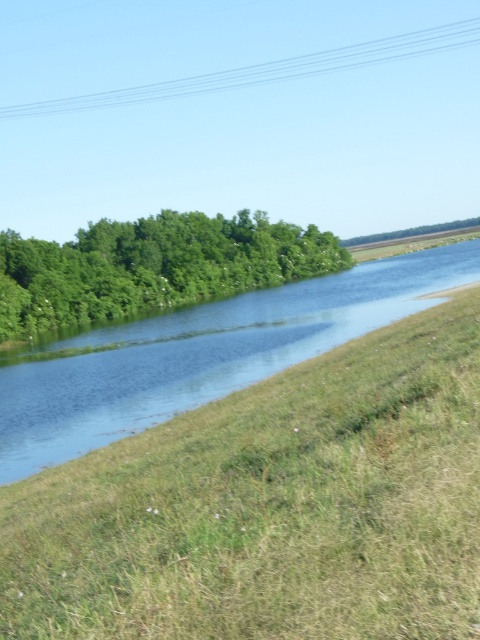
Question: Can you confirm if blue smooth water at center is smaller than green leafy trees at center?

Choices:
 (A) yes
 (B) no

Answer: (A)

Question: Is blue smooth water at center to the left of green leafy trees at center from the viewer's perspective?

Choices:
 (A) no
 (B) yes

Answer: (A)

Question: Which object appears closest to the camera in this image?

Choices:
 (A) blue smooth water at center
 (B) green leafy trees at center

Answer: (A)

Question: Does blue smooth water at center have a larger size compared to green leafy trees at center?

Choices:
 (A) no
 (B) yes

Answer: (A)